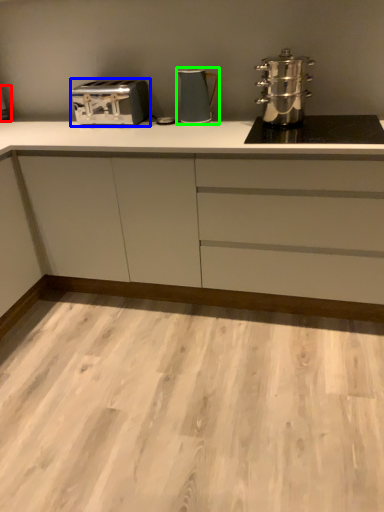
Question: Based on their relative distances, which object is nearer to appliance (highlighted by a red box)? Choose from toaster (highlighted by a blue box) and kitchen appliance (highlighted by a green box).

Choices:
 (A) toaster
 (B) kitchen appliance

Answer: (A)